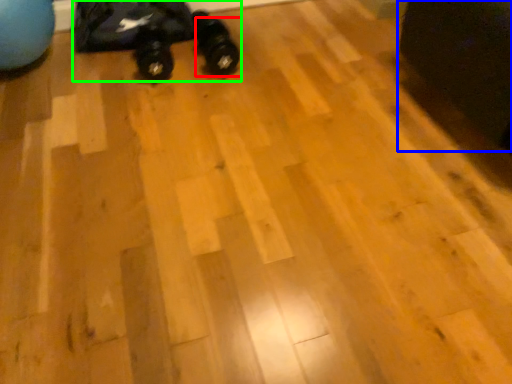
Question: Which object is positioned closest to footwear (highlighted by a red box)? Select from swivel chair (highlighted by a blue box) and toy car (highlighted by a green box).

Choices:
 (A) swivel chair
 (B) toy car

Answer: (B)